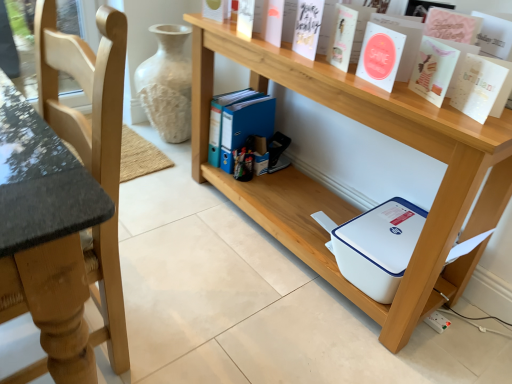
I want to click on free location in front of white matte paper at upper center, which is counted as the first paperback book, starting from the left, so click(x=324, y=67).